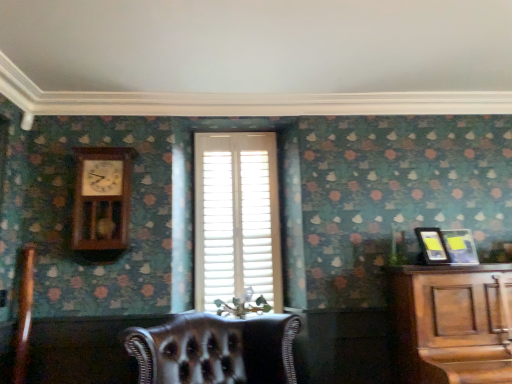
Question: Considering the relative positions of matte black picture frame at right, which is counted as the second picture frame, starting from the right, and metallic silver picture frame at right, the second picture frame in the left-to-right sequence, in the image provided, is matte black picture frame at right, which is counted as the second picture frame, starting from the right, to the left of metallic silver picture frame at right, the second picture frame in the left-to-right sequence, from the viewer's perspective?

Choices:
 (A) no
 (B) yes

Answer: (B)

Question: From a real-world perspective, is matte black picture frame at right, arranged as the 1th picture frame when viewed from the left, located higher than metallic silver picture frame at right, which is the 1th picture frame from right to left?

Choices:
 (A) no
 (B) yes

Answer: (A)

Question: Can you confirm if matte black picture frame at right, arranged as the 1th picture frame when viewed from the left, is taller than metallic silver picture frame at right, the second picture frame in the left-to-right sequence?

Choices:
 (A) no
 (B) yes

Answer: (B)

Question: Are matte black picture frame at right, which is counted as the second picture frame, starting from the right, and metallic silver picture frame at right, which is the 1th picture frame from right to left, making contact?

Choices:
 (A) yes
 (B) no

Answer: (B)

Question: Is matte black picture frame at right, arranged as the 1th picture frame when viewed from the left, far from metallic silver picture frame at right, the second picture frame in the left-to-right sequence?

Choices:
 (A) yes
 (B) no

Answer: (B)

Question: Could metallic silver picture frame at right, the second picture frame in the left-to-right sequence, be considered to be inside matte black picture frame at right, arranged as the 1th picture frame when viewed from the left?

Choices:
 (A) yes
 (B) no

Answer: (B)

Question: Does wooden pendulum clock at upper left have a larger size compared to white wood blinds at center?

Choices:
 (A) no
 (B) yes

Answer: (A)

Question: From a real-world perspective, is wooden pendulum clock at upper left positioned under white wood blinds at center based on gravity?

Choices:
 (A) no
 (B) yes

Answer: (A)

Question: Is wooden pendulum clock at upper left shorter than white wood blinds at center?

Choices:
 (A) no
 (B) yes

Answer: (B)

Question: Is the depth of wooden pendulum clock at upper left less than that of white wood blinds at center?

Choices:
 (A) yes
 (B) no

Answer: (A)

Question: From a real-world perspective, is wooden pendulum clock at upper left located higher than white wood blinds at center?

Choices:
 (A) yes
 (B) no

Answer: (A)

Question: Is there a large distance between wooden pendulum clock at upper left and white wood blinds at center?

Choices:
 (A) no
 (B) yes

Answer: (A)

Question: Is metallic silver picture frame at right, which is the 1th picture frame from right to left, positioned behind matte black picture frame at right, arranged as the 1th picture frame when viewed from the left?

Choices:
 (A) no
 (B) yes

Answer: (B)